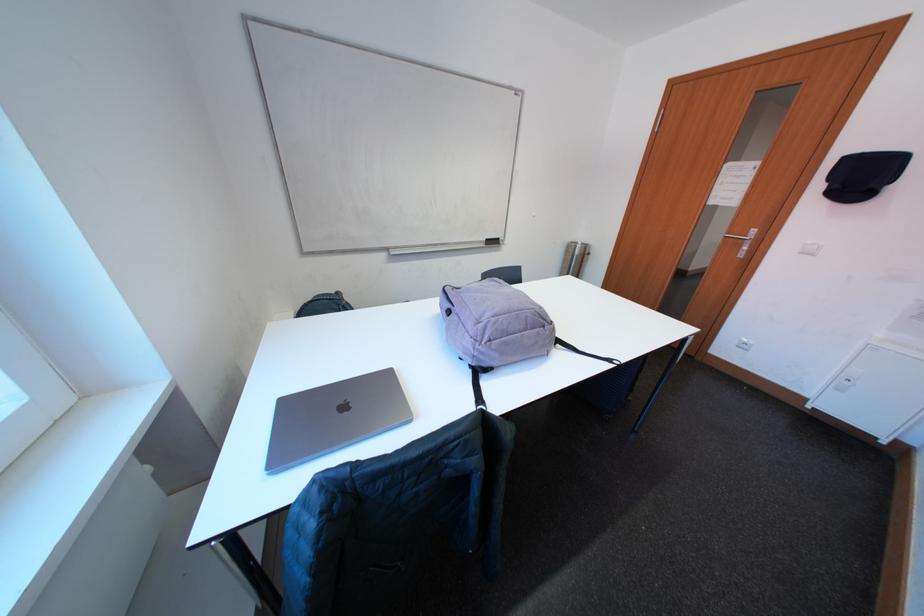
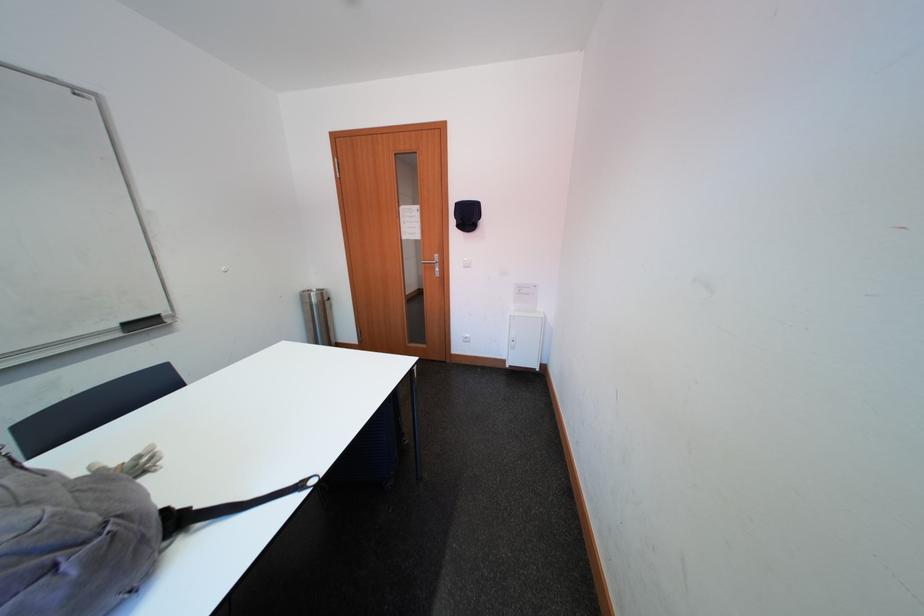
Question: How did the camera likely rotate?

Choices:
 (A) Left
 (B) Right
 (C) Up
 (D) Down

Answer: (B)